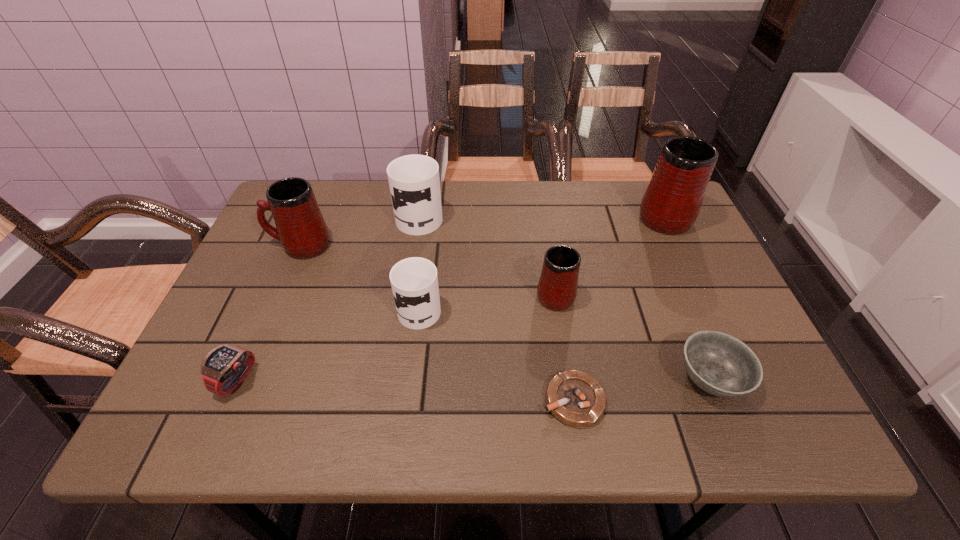
Locate an element on the screen. the biggest red mug is located at coordinates (671, 203).

At what (x,y) coordinates should I click in order to perform the action: click on the tallest mug. Please return your answer as a coordinate pair (x, y). Image resolution: width=960 pixels, height=540 pixels. Looking at the image, I should click on (671, 203).

This screenshot has height=540, width=960. Identify the location of the second smallest red mug. (300, 227).

Locate an element on the screen. This screenshot has height=540, width=960. the leftmost red mug is located at coordinates (300, 227).

What are the coordinates of `the bigger white mug` in the screenshot? It's located at (414, 182).

Identify the location of the second red mug from right to left. (557, 288).

Identify the location of the smallest red mug. The width and height of the screenshot is (960, 540). (557, 288).

You are a GUI agent. You are given a task and a screenshot of the screen. Output one action in this format:
    pyautogui.click(x=<x>, y=<y>)
    Task: Click on the smaller white mug
    Image resolution: width=960 pixels, height=540 pixels.
    Given the screenshot: What is the action you would take?
    pyautogui.click(x=414, y=281)

You are a GUI agent. You are given a task and a screenshot of the screen. Output one action in this format:
    pyautogui.click(x=<x>, y=<y>)
    Task: Click on the watch
    The width and height of the screenshot is (960, 540).
    Given the screenshot: What is the action you would take?
    pyautogui.click(x=224, y=368)

Where is `gray bowl`? gray bowl is located at coordinates coord(720,364).